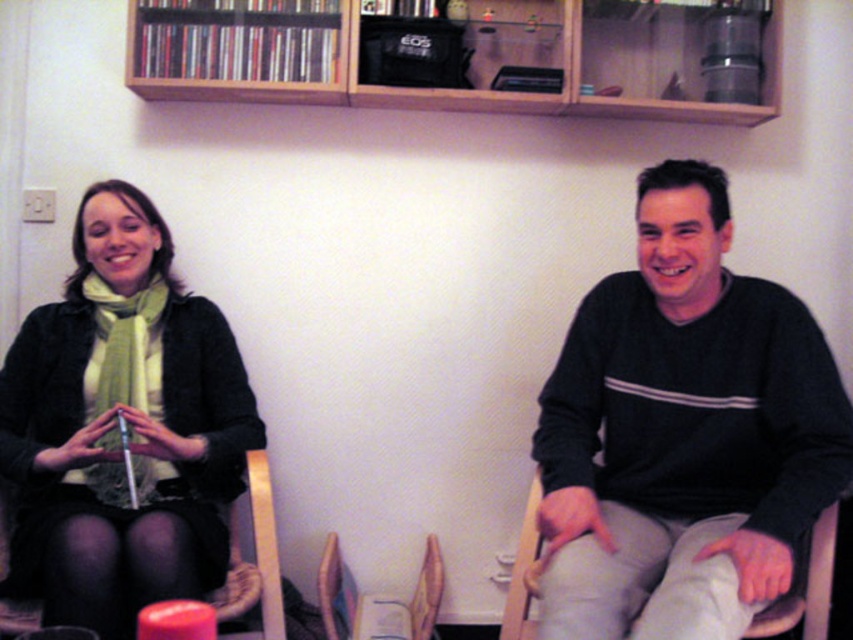
From the picture: Is wooden bookshelf at upper center closer to the viewer compared to wooden chair at lower left?

No, it is not.

Is wooden bookshelf at upper center shorter than wooden chair at lower left?

Yes.

Does point (611, 58) come closer to viewer compared to point (270, 486)?

No, (611, 58) is behind (270, 486).

The height and width of the screenshot is (640, 853). I want to click on wooden bookshelf at upper center, so click(x=467, y=48).

Is wooden chair at right further to the viewer compared to wooden chair at lower left?

No, wooden chair at right is in front of wooden chair at lower left.

Between wooden chair at right and wooden chair at lower left, which one is positioned higher?

wooden chair at lower left is above.

Where is `wooden chair at right`? This screenshot has height=640, width=853. wooden chair at right is located at coordinates (805, 586).

Identify the location of wooden chair at right. (805, 586).

Can you confirm if wooden armchair at center is shorter than wooden chair at lower left?

Indeed, wooden armchair at center has a lesser height compared to wooden chair at lower left.

This screenshot has height=640, width=853. What do you see at coordinates (338, 596) in the screenshot? I see `wooden armchair at center` at bounding box center [338, 596].

Who is more forward, (x=438, y=552) or (x=253, y=520)?

Point (x=253, y=520) is more forward.

The height and width of the screenshot is (640, 853). I want to click on wooden armchair at center, so click(338, 596).